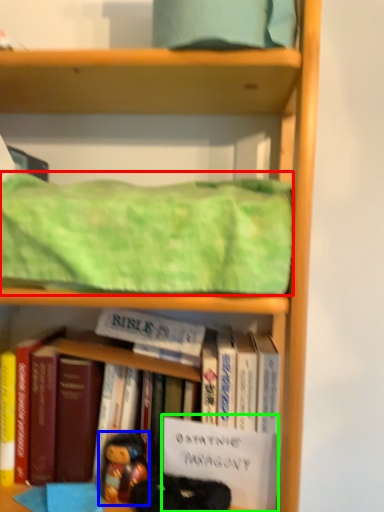
Question: Estimate the real-world distances between objects in this image. Which object is farther from blanket (highlighted by a red box), person (highlighted by a blue box) or paperback book (highlighted by a green box)?

Choices:
 (A) person
 (B) paperback book

Answer: (A)